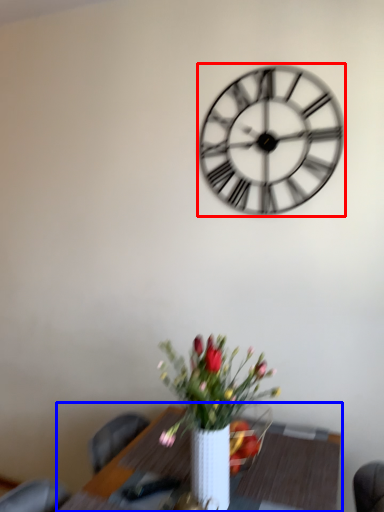
Question: Which object is closer to the camera taking this photo, wall clock (highlighted by a red box) or table (highlighted by a blue box)?

Choices:
 (A) wall clock
 (B) table

Answer: (B)